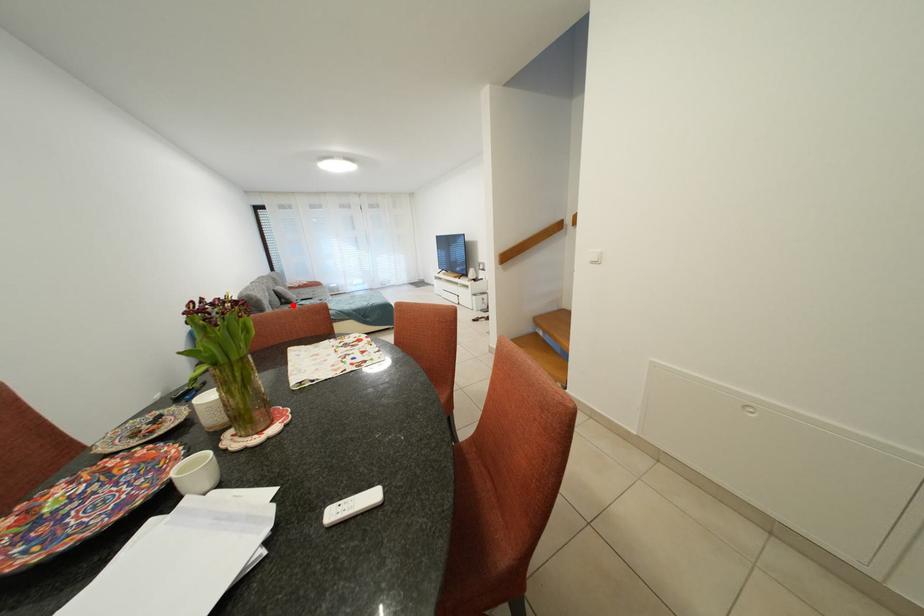
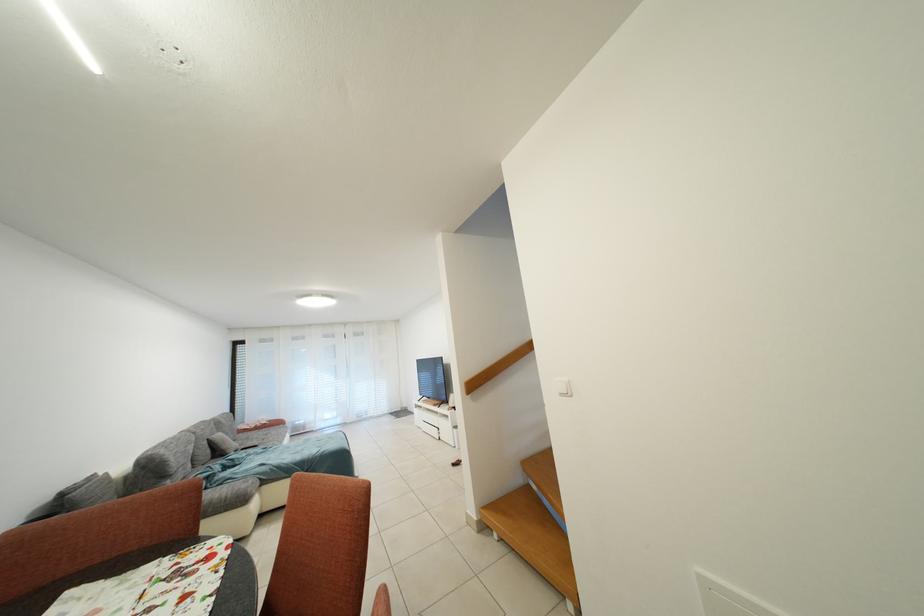
Find the pixel in the second image that matches the highlighted location in the first image.

(226, 456)